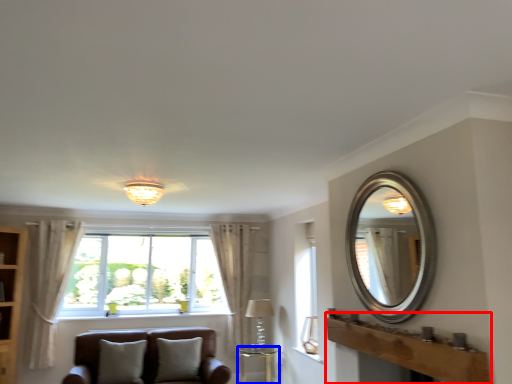
Question: Which object appears farthest to the camera in this image, mantle (highlighted by a red box) or table (highlighted by a blue box)?

Choices:
 (A) mantle
 (B) table

Answer: (B)